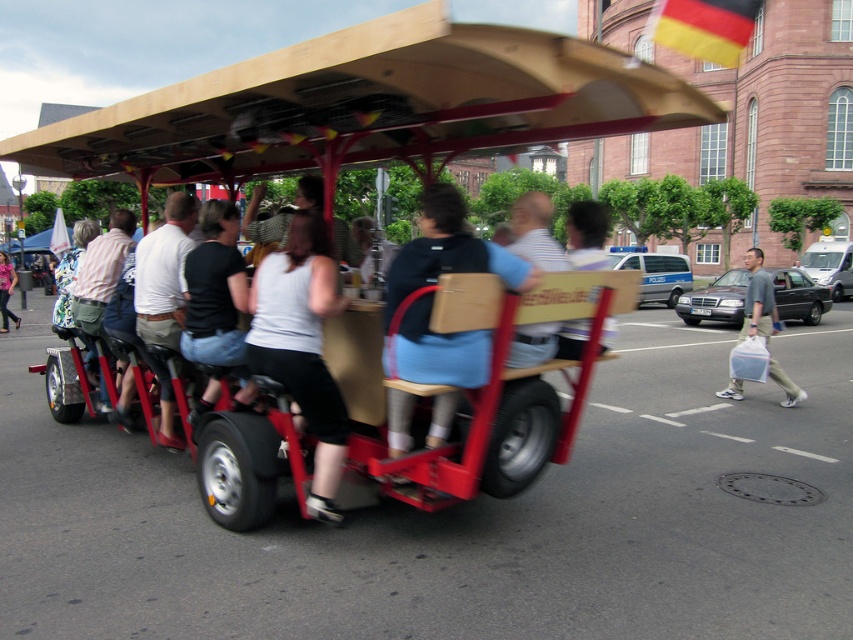
Can you confirm if black cotton shirt at center is positioned to the right of denim jacket at lower left?

Indeed, black cotton shirt at center is positioned on the right side of denim jacket at lower left.

Which is behind, point (215, 314) or point (3, 252)?

The point (3, 252) is behind.

The image size is (853, 640). Identify the location of black cotton shirt at center. (215, 291).

Is blue denim skirt at center to the left of white matte shirt at center from the viewer's perspective?

In fact, blue denim skirt at center is to the right of white matte shirt at center.

Is point (415, 337) closer to camera compared to point (160, 442)?

That is True.

Find the location of a particular element. The height and width of the screenshot is (640, 853). blue denim skirt at center is located at coordinates (448, 250).

What do you see at coordinates (164, 273) in the screenshot?
I see `white matte shirt at center` at bounding box center [164, 273].

Is white matte shirt at center taller than gray fabric bag at lower right?

Incorrect, white matte shirt at center's height is not larger of gray fabric bag at lower right's.

Is point (160, 243) positioned after point (753, 326)?

No, it is not.

The height and width of the screenshot is (640, 853). What are the coordinates of `white matte shirt at center` in the screenshot? It's located at (164, 273).